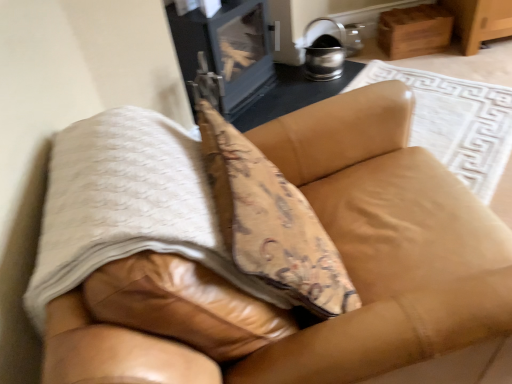
Question: From a real-world perspective, is metallic silver stove at upper center beneath white textured blanket at center?

Choices:
 (A) no
 (B) yes

Answer: (B)

Question: Is metallic silver stove at upper center oriented away from white textured blanket at center?

Choices:
 (A) yes
 (B) no

Answer: (B)

Question: From the image's perspective, is metallic silver stove at upper center on white textured blanket at center?

Choices:
 (A) no
 (B) yes

Answer: (B)

Question: Does metallic silver stove at upper center come in front of white textured blanket at center?

Choices:
 (A) yes
 (B) no

Answer: (B)

Question: Is metallic silver stove at upper center wider than white textured blanket at center?

Choices:
 (A) yes
 (B) no

Answer: (B)

Question: From a real-world perspective, is white textured blanket at center positioned above or below leather couch at center?

Choices:
 (A) above
 (B) below

Answer: (A)

Question: Based on their positions, is white textured blanket at center located to the left or right of leather couch at center?

Choices:
 (A) left
 (B) right

Answer: (A)

Question: Choose the correct answer: Is white textured blanket at center inside leather couch at center or outside it?

Choices:
 (A) inside
 (B) outside

Answer: (A)

Question: Looking at their shapes, would you say white textured blanket at center is wider or thinner than leather couch at center?

Choices:
 (A) thin
 (B) wide

Answer: (A)

Question: From a real-world perspective, is metallic silver stove at upper center physically located above or below white textured blanket at center?

Choices:
 (A) above
 (B) below

Answer: (B)

Question: Looking at the image, does metallic silver stove at upper center seem bigger or smaller compared to white textured blanket at center?

Choices:
 (A) big
 (B) small

Answer: (B)

Question: Looking at their shapes, would you say metallic silver stove at upper center is wider or thinner than white textured blanket at center?

Choices:
 (A) wide
 (B) thin

Answer: (B)

Question: From the image's perspective, is metallic silver stove at upper center above or below white textured blanket at center?

Choices:
 (A) below
 (B) above

Answer: (B)

Question: Is metallic silver stove at upper center in front of or behind leather couch at center in the image?

Choices:
 (A) front
 (B) behind

Answer: (B)

Question: From the image's perspective, is metallic silver stove at upper center above or below leather couch at center?

Choices:
 (A) above
 (B) below

Answer: (A)